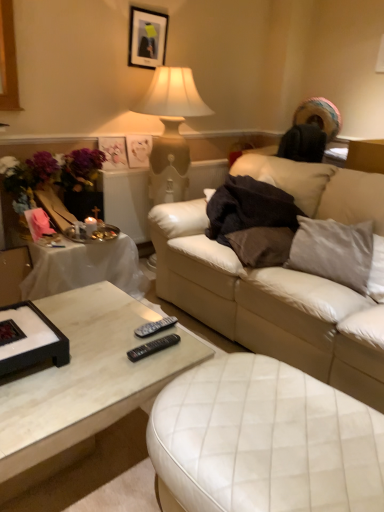
In order to click on free space above white leather ottoman at center (from a real-world perspective) in this screenshot , I will do `click(278, 426)`.